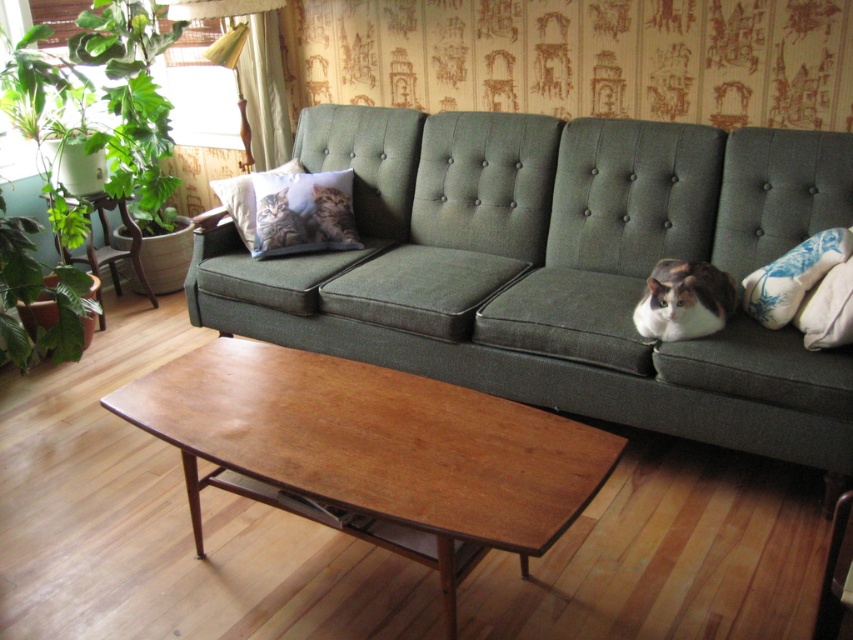
You are planning to place a new decorative item on the green fabric couch at center and the tabby fur pillow at center. If the item is 1.2 meters wide, which object can it fit on?

The green fabric couch at center is larger in size than the tabby fur pillow at center, so the item can fit on the green fabric couch at center.

You are a person who wants to place a book on the wooden coffee table at center and the blue floral pillow at right. Which object allows you to place the book higher off the ground?

The wooden coffee table at center is taller than the blue floral pillow at right, so placing the book on the wooden coffee table at center will keep it higher off the ground.

You are a guest entering the living room and want to sit on the tabby fur pillow at center. Can you sit on it without moving the green fabric couch at center?

The green fabric couch at center is located below the tabby fur pillow at center, so the pillow is likely placed on the couch. Therefore, you can sit on the tabby fur pillow at center without needing to move the green fabric couch at center.